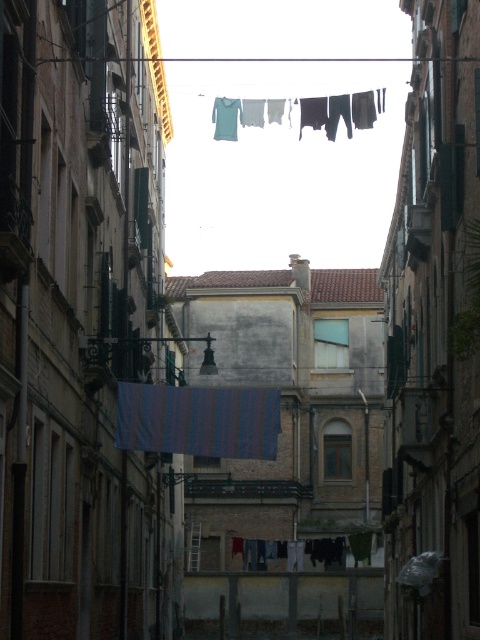
You are a delivery person carrying a package that requires a safe path to the delivery point. You see two striped fabrics in the alleyway. The striped fabric at center and the striped fabric clothesline at center. Which one is farther away from you?

The striped fabric at center is 13.08 meters away from striped fabric clothesline at center, so the striped fabric clothesline at center is farther away from you.

You are a delivery person carrying a package and need to walk through the narrow alleyway. There is a striped fabric at center and a striped fabric clothesline at center. Which object might you need to duck under to avoid hitting your head?

The striped fabric clothesline at center is above the striped fabric at center, so you would need to duck under the striped fabric clothesline at center to avoid hitting your head.